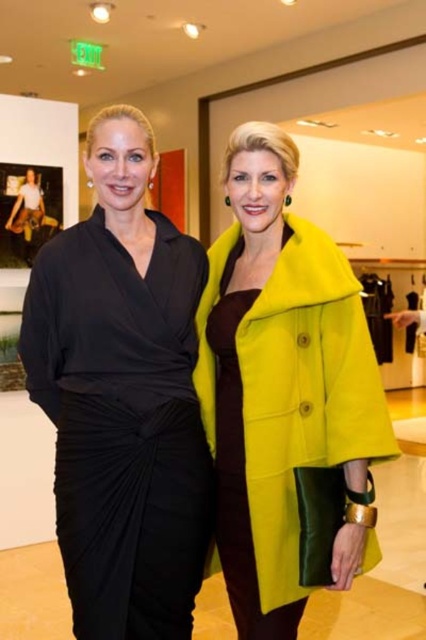
Question: Can you confirm if vibrant yellow wool coat at center is positioned to the right of matte green coat at center?

Choices:
 (A) no
 (B) yes

Answer: (A)

Question: Which point is closer to the camera?

Choices:
 (A) (423, 301)
 (B) (271, 358)

Answer: (B)

Question: Can you confirm if matte black dress at left is positioned to the right of matte green coat at center?

Choices:
 (A) yes
 (B) no

Answer: (B)

Question: Does matte black dress at left appear on the left side of matte green coat at center?

Choices:
 (A) yes
 (B) no

Answer: (A)

Question: Among these points, which one is nearest to the camera?

Choices:
 (A) (371, 449)
 (B) (402, 310)

Answer: (A)

Question: Which of the following is the closest to the observer?

Choices:
 (A) [423, 586]
 (B) [88, 435]
 (C) [210, 369]

Answer: (B)